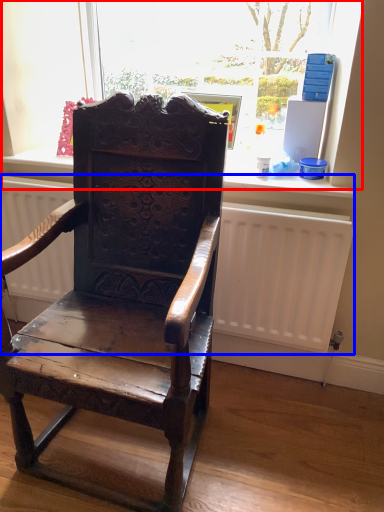
Question: Which object appears closest to the camera in this image, bay window (highlighted by a red box) or radiator (highlighted by a blue box)?

Choices:
 (A) bay window
 (B) radiator

Answer: (B)